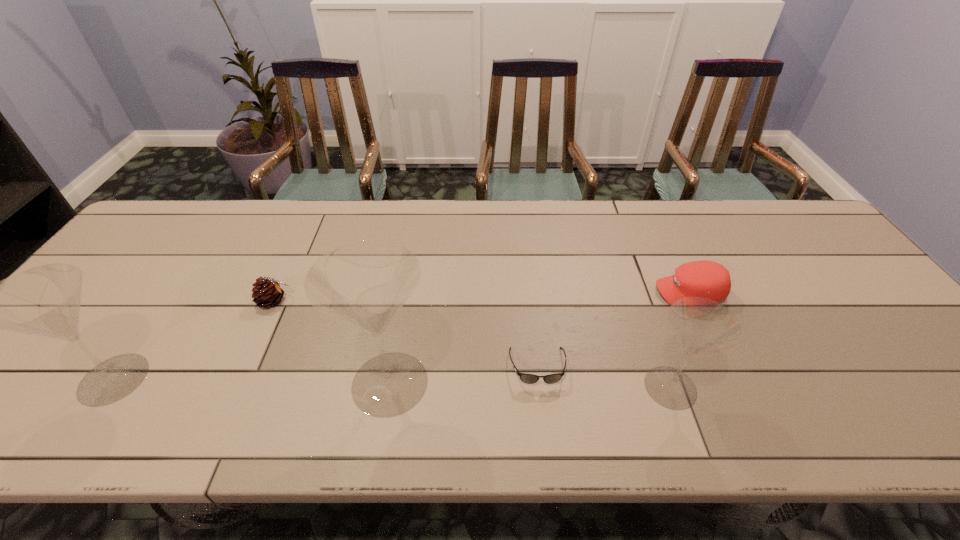
Identify the location of free space in the image that satisfies the following two spatial constraints: 1. on the front-facing side of the cap; 2. on the front-facing side of the fourth object from left to right. 725,367.

This screenshot has width=960, height=540. I want to click on free space that satisfies the following two spatial constraints: 1. on the back side of the shortest flute glass; 2. with a leaf charm attached to the pinecone, so click(640, 301).

The width and height of the screenshot is (960, 540). Identify the location of vacant region that satisfies the following two spatial constraints: 1. with a leaf charm attached to the second object from left to right; 2. on the right side of the third object from left to right. (236, 383).